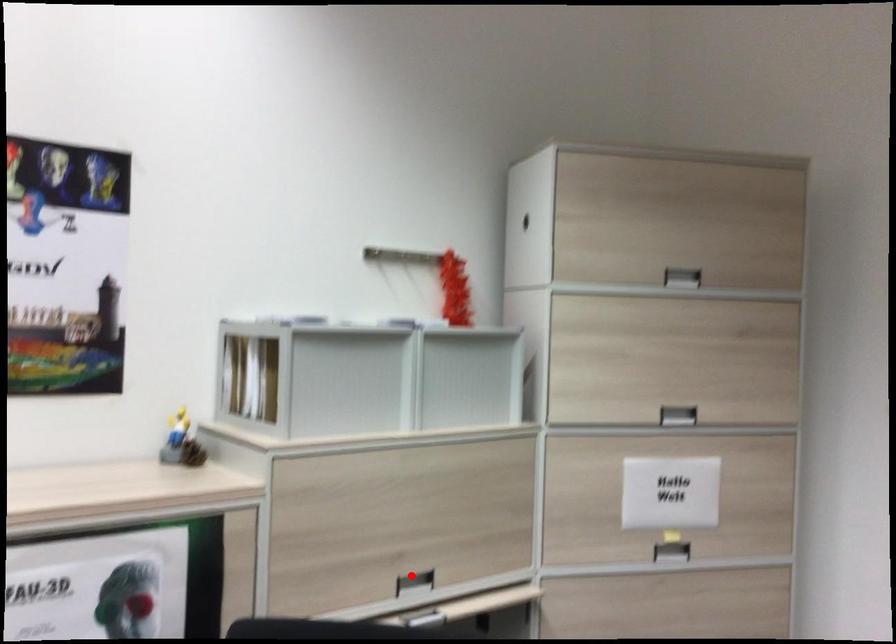
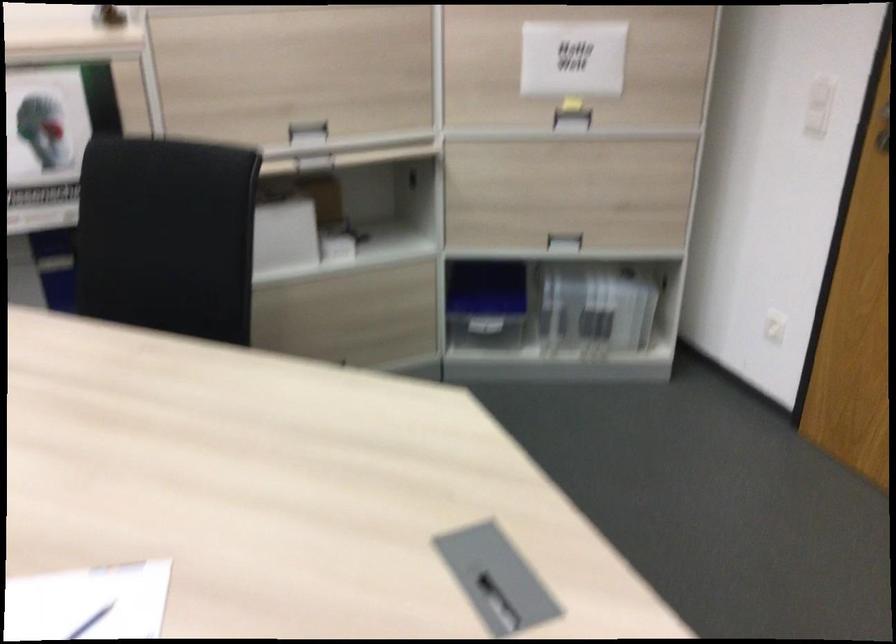
The point at the highlighted location is marked in the first image. Where is the corresponding point in the second image?

(307, 129)